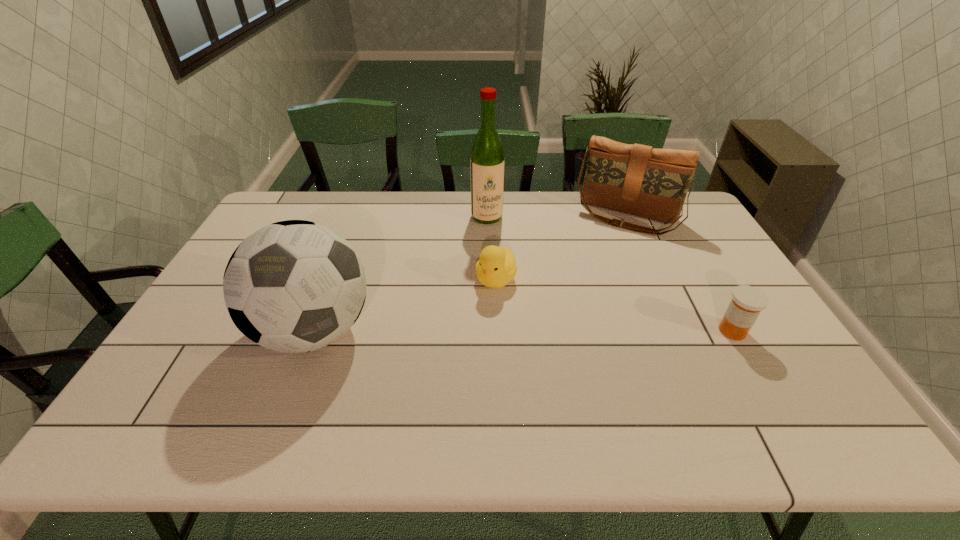
You are a GUI agent. You are given a task and a screenshot of the screen. Output one action in this format:
    pyautogui.click(x=<x>, y=<y>)
    Task: Click on the empty location between the third shortest object and the medicine
    This screenshot has height=540, width=960.
    Given the screenshot: What is the action you would take?
    pyautogui.click(x=679, y=274)

Locate an element on the screen. empty location between the medicine and the third shortest object is located at coordinates (679, 274).

Where is `vacant area that lies between the duck and the third tallest object`? The width and height of the screenshot is (960, 540). vacant area that lies between the duck and the third tallest object is located at coordinates (561, 248).

At what (x,y) coordinates should I click in order to perform the action: click on vacant point located between the third shortest object and the duck. Please return your answer as a coordinate pair (x, y). Looking at the image, I should click on (561, 248).

You are a GUI agent. You are given a task and a screenshot of the screen. Output one action in this format:
    pyautogui.click(x=<x>, y=<y>)
    Task: Click on the free point between the tallest object and the medicine
    
    Given the screenshot: What is the action you would take?
    pyautogui.click(x=610, y=274)

You are a GUI agent. You are given a task and a screenshot of the screen. Output one action in this format:
    pyautogui.click(x=<x>, y=<y>)
    Task: Click on the vacant area between the medicine and the liquor
    The height and width of the screenshot is (540, 960).
    Given the screenshot: What is the action you would take?
    pyautogui.click(x=610, y=274)

Image resolution: width=960 pixels, height=540 pixels. I want to click on object identified as the fourth closest to the medicine, so click(293, 286).

I want to click on object that is the third closest to the medicine, so click(487, 162).

Where is `vacant region that satisfies the following two spatial constraints: 1. on the back side of the duck; 2. on the right side of the third shortest object`? Image resolution: width=960 pixels, height=540 pixels. vacant region that satisfies the following two spatial constraints: 1. on the back side of the duck; 2. on the right side of the third shortest object is located at coordinates (493, 217).